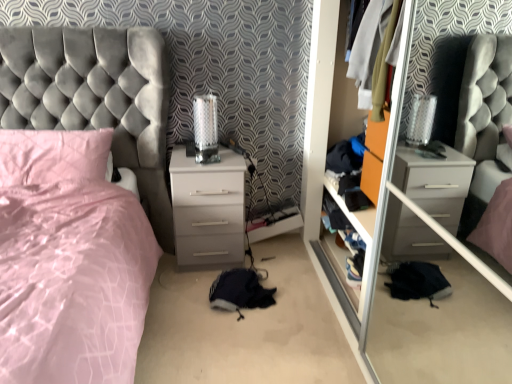
Question: Does wooden shelf at center have a lesser width compared to satin pink pillow at left?

Choices:
 (A) yes
 (B) no

Answer: (A)

Question: Are wooden shelf at center and satin pink pillow at left located far from each other?

Choices:
 (A) yes
 (B) no

Answer: (A)

Question: Does wooden shelf at center have a greater width compared to satin pink pillow at left?

Choices:
 (A) no
 (B) yes

Answer: (A)

Question: Is wooden shelf at center to the left of satin pink pillow at left from the viewer's perspective?

Choices:
 (A) no
 (B) yes

Answer: (A)

Question: Does wooden shelf at center have a greater height compared to satin pink pillow at left?

Choices:
 (A) no
 (B) yes

Answer: (B)

Question: Relative to transparent glass door at center, is wooden shelf at center in front or behind?

Choices:
 (A) front
 (B) behind

Answer: (B)

Question: From a real-world perspective, relative to transparent glass door at center, is wooden shelf at center vertically above or below?

Choices:
 (A) below
 (B) above

Answer: (A)

Question: Is point (322, 233) closer or farther from the camera than point (347, 324)?

Choices:
 (A) farther
 (B) closer

Answer: (A)

Question: Is wooden shelf at center to the left or to the right of transparent glass door at center in the image?

Choices:
 (A) right
 (B) left

Answer: (B)

Question: Based on their sizes in the image, would you say transparent glass door at center is bigger or smaller than satin pink pillow at left?

Choices:
 (A) small
 (B) big

Answer: (B)

Question: Choose the correct answer: Is transparent glass door at center inside satin pink pillow at left or outside it?

Choices:
 (A) outside
 (B) inside

Answer: (A)

Question: Is point click(366, 352) closer or farther from the camera than point click(91, 137)?

Choices:
 (A) farther
 (B) closer

Answer: (B)

Question: From a real-world perspective, is transparent glass door at center positioned above or below satin pink pillow at left?

Choices:
 (A) below
 (B) above

Answer: (B)

Question: From their relative heights in the image, would you say white glossy chest of drawers at center is taller or shorter than velvet grey bed at left?

Choices:
 (A) short
 (B) tall

Answer: (A)

Question: Relative to velvet grey bed at left, is white glossy chest of drawers at center in front or behind?

Choices:
 (A) behind
 (B) front

Answer: (A)